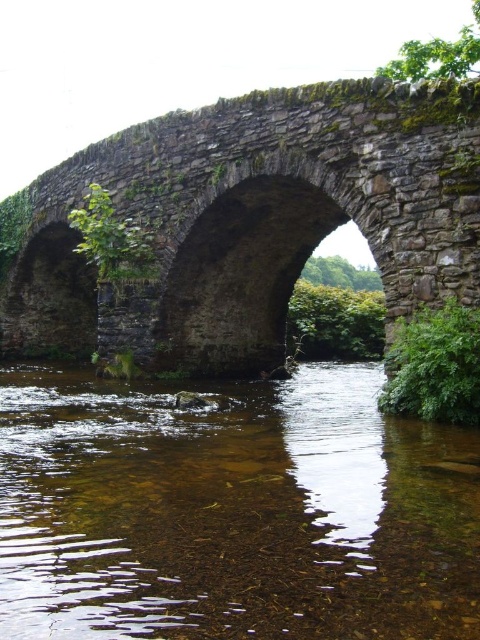
Question: Does clear water at center lie behind rusty stone bridge at center?

Choices:
 (A) yes
 (B) no

Answer: (B)

Question: Which point is farther from the camera taking this photo?

Choices:
 (A) (139, 413)
 (B) (243, 310)

Answer: (B)

Question: Is the position of clear water at center more distant than that of rusty stone bridge at center?

Choices:
 (A) no
 (B) yes

Answer: (A)

Question: Is clear water at center bigger than rusty stone bridge at center?

Choices:
 (A) yes
 (B) no

Answer: (B)